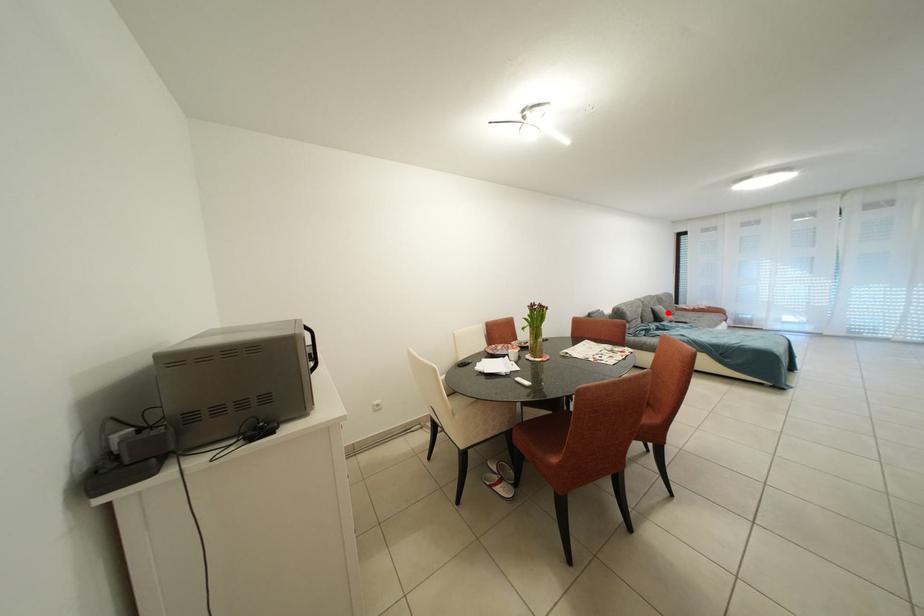
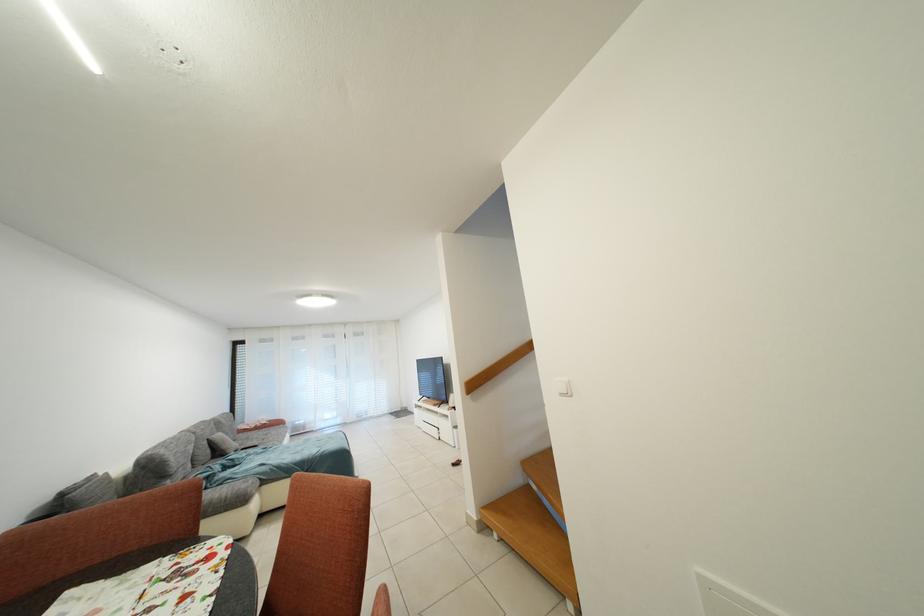
In the second image, find the point that corresponds to the highlighted location in the first image.

(227, 440)